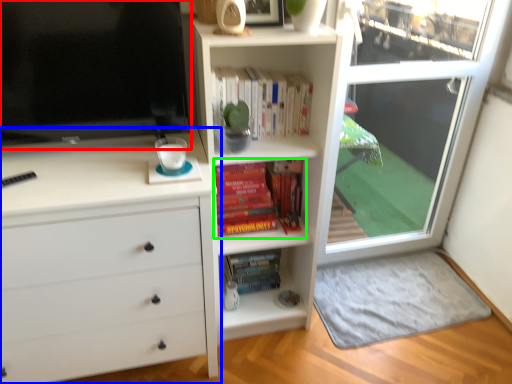
Question: Based on their relative distances, which object is farther from television (highlighted by a red box)? Choose from chest of drawers (highlighted by a blue box) and book (highlighted by a green box).

Choices:
 (A) chest of drawers
 (B) book

Answer: (B)